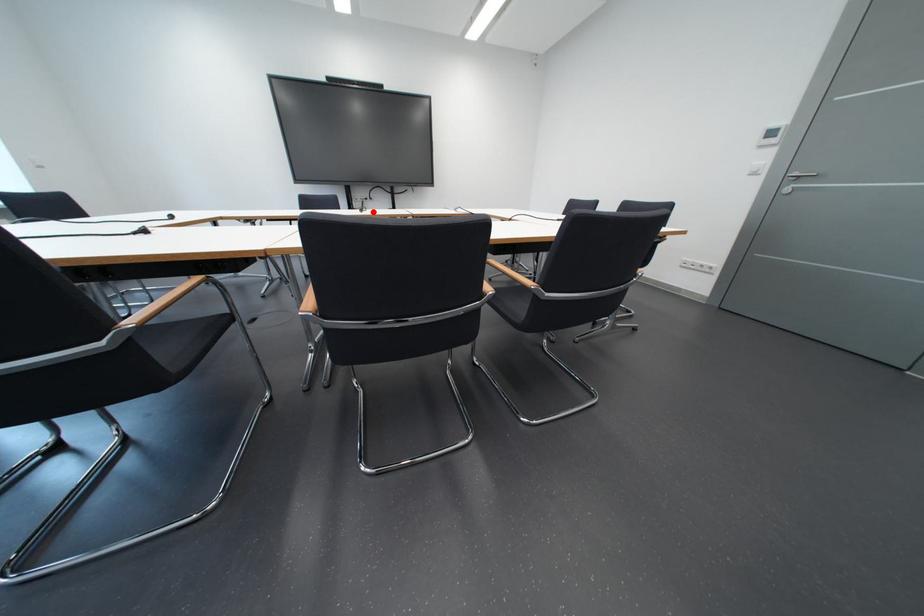
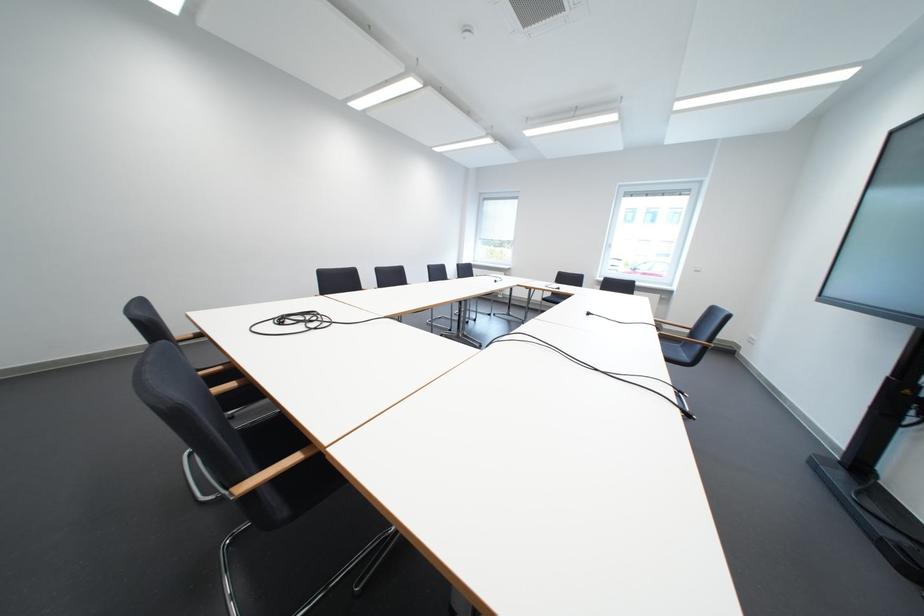
Where in the second image is the point corresponding to the highlighted location from the first image?

(601, 315)